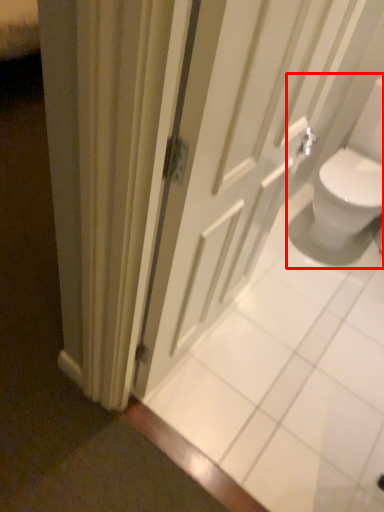
Question: Considering the relative positions of sink (annotated by the red box) and door in the image provided, where is sink (annotated by the red box) located with respect to the staircase?

Choices:
 (A) right
 (B) left

Answer: (A)